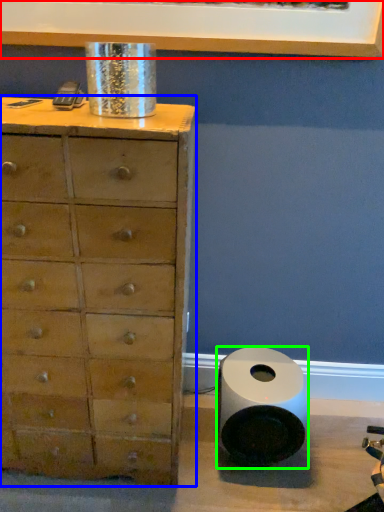
Question: Considering the real-world distances, which object is closest to picture frame (highlighted by a red box)? chest of drawers (highlighted by a blue box) or speaker (highlighted by a green box).

Choices:
 (A) chest of drawers
 (B) speaker

Answer: (A)